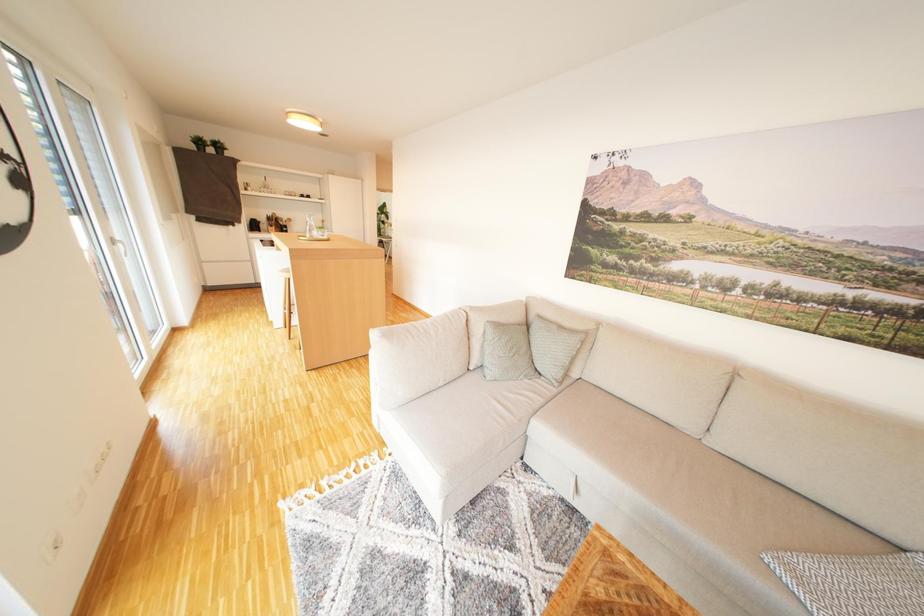
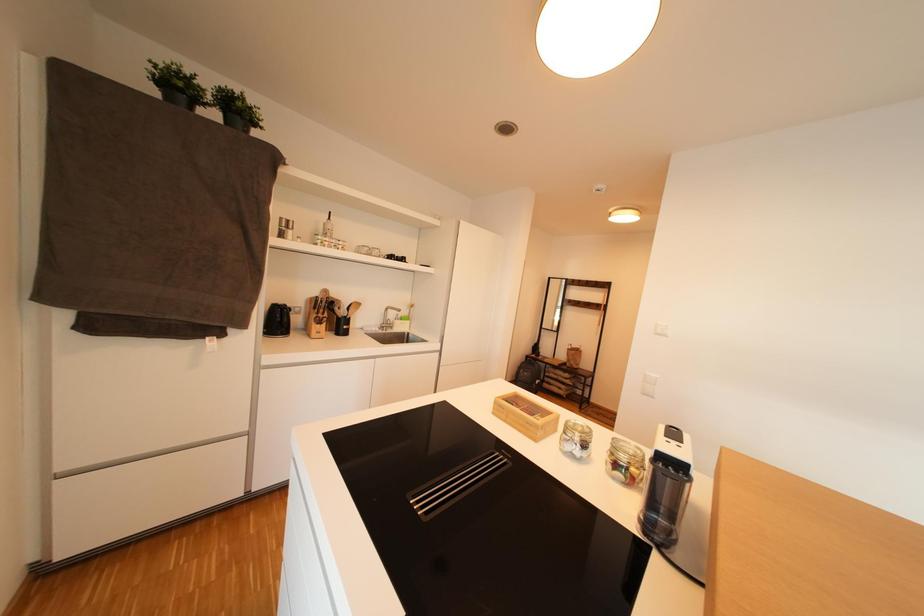
What movement of the cameraman would produce the second image?

The cameraman walked toward left, forward.